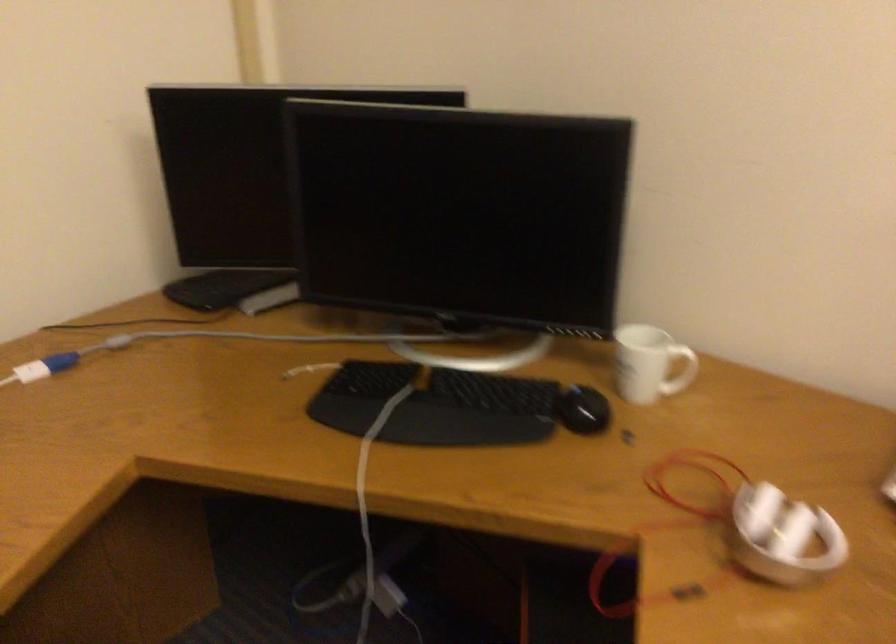
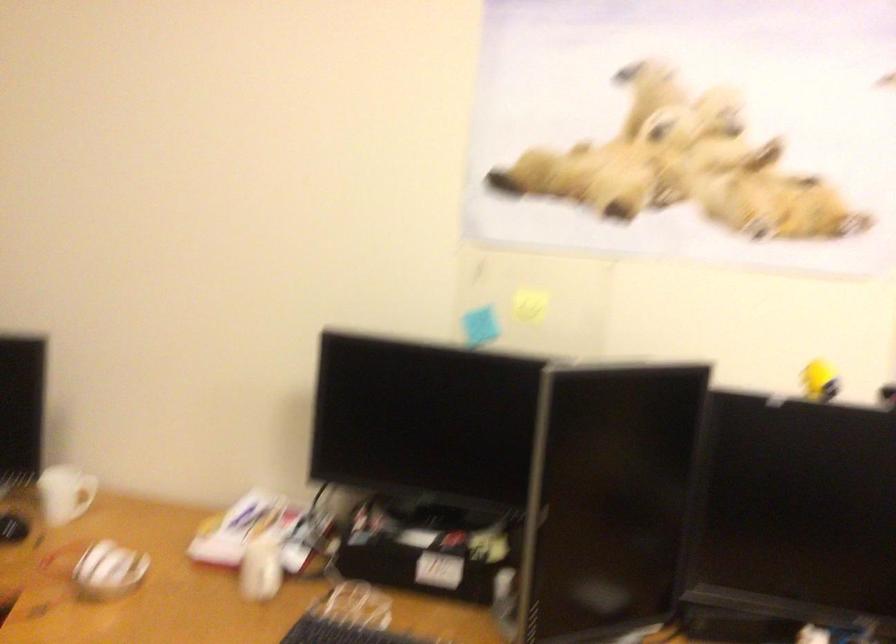
The images are taken continuously from a first-person perspective. In which direction is your viewpoint rotating?

The camera rotated toward right-up.